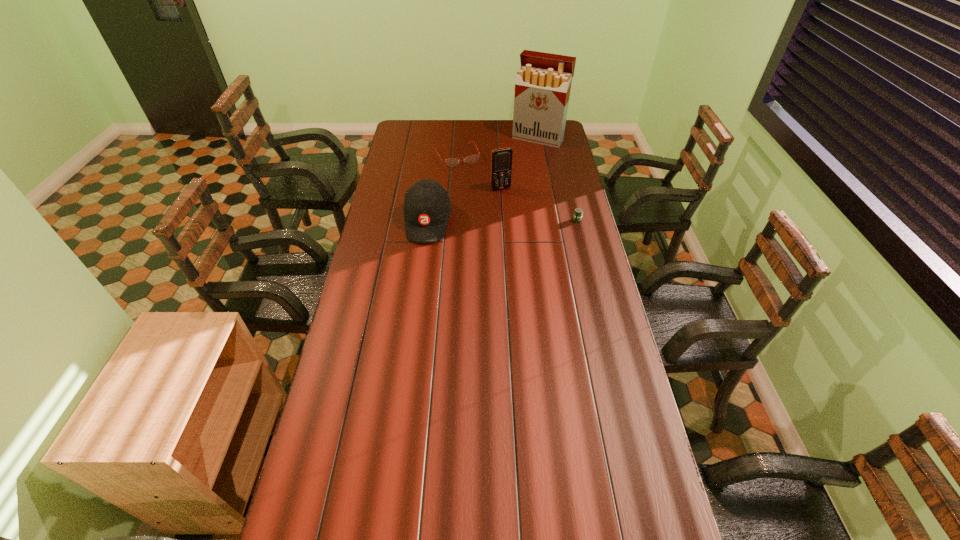
Identify the location of vacant space on the desktop that is between the baseball cap and the beer can and is positioned on the lenses of the spectacles. (493, 221).

Where is `vacant spot on the desktop that is between the baseball cap and the beer can and is positioned on the screen of the third object from left to right`? This screenshot has width=960, height=540. vacant spot on the desktop that is between the baseball cap and the beer can and is positioned on the screen of the third object from left to right is located at coordinates (519, 221).

This screenshot has width=960, height=540. In order to click on vacant spot on the desktop that is between the baseball cap and the beer can and is positioned with the lid open on the cigarette case in this screenshot , I will do `click(486, 221)`.